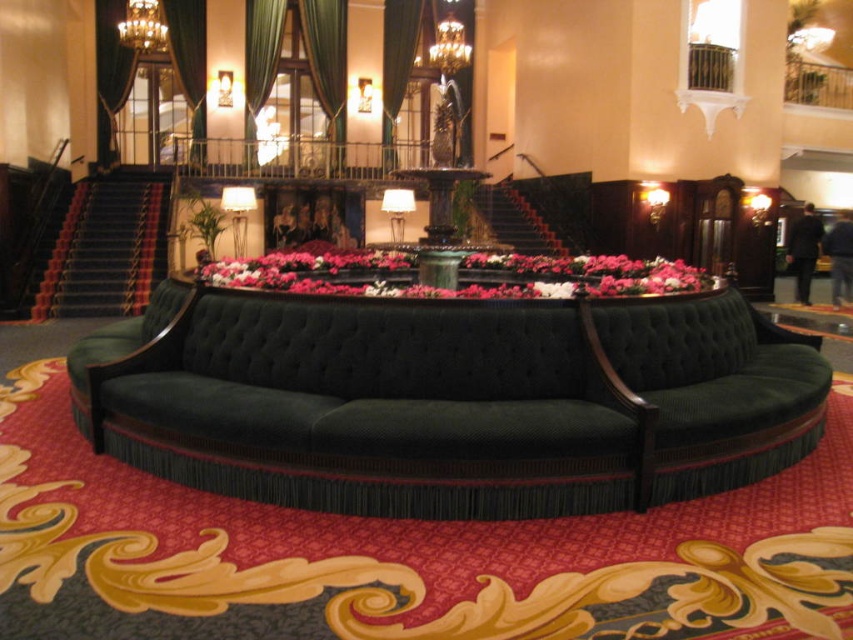
Question: Does velvet green couch at center appear over dark red carpeted stairs at left?

Choices:
 (A) no
 (B) yes

Answer: (A)

Question: Which object is farther from the camera taking this photo?

Choices:
 (A) green velvet curtain at upper center
 (B) pink fabric flowers at center

Answer: (A)

Question: Where is pink fabric flowers at center located in relation to green velvet curtain at upper center in the image?

Choices:
 (A) right
 (B) left

Answer: (A)

Question: In this image, where is velvet green couch at center located relative to dark red carpeted stairs at left?

Choices:
 (A) right
 (B) left

Answer: (A)

Question: Which object appears closest to the camera in this image?

Choices:
 (A) pink fabric flowers at center
 (B) dark red carpeted stairs at left
 (C) velvet green couch at center
 (D) green velvet curtain at upper center

Answer: (C)

Question: Which object appears closest to the camera in this image?

Choices:
 (A) green velvet curtain at upper center
 (B) velvet green couch at center
 (C) dark red carpeted stairs at left
 (D) pink fabric flowers at center

Answer: (B)